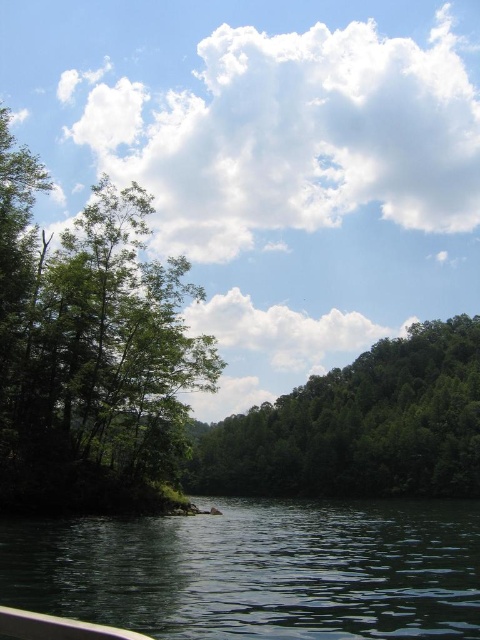
Does point (347, 520) come farther from viewer compared to point (45, 342)?

Yes, it is behind point (45, 342).

What do you see at coordinates (256, 570) in the screenshot? I see `dark green water at lower left` at bounding box center [256, 570].

I want to click on dark green water at lower left, so click(x=256, y=570).

Between point (274, 589) and point (254, 468), which one is positioned behind?

The point (254, 468) is more distant.

Can you confirm if dark green water at lower left is positioned to the left of green leafy tree at center?

Yes, dark green water at lower left is to the left of green leafy tree at center.

What are the coordinates of `dark green water at lower left` in the screenshot? It's located at (256, 570).

Who is positioned more to the left, green leafy tree at left or green leafy tree at center?

green leafy tree at left is more to the left.

Who is lower down, green leafy tree at left or green leafy tree at center?

green leafy tree at center

Is point (87, 458) farther from camera compared to point (388, 384)?

That is False.

Where is `green leafy tree at left`? green leafy tree at left is located at coordinates (92, 353).